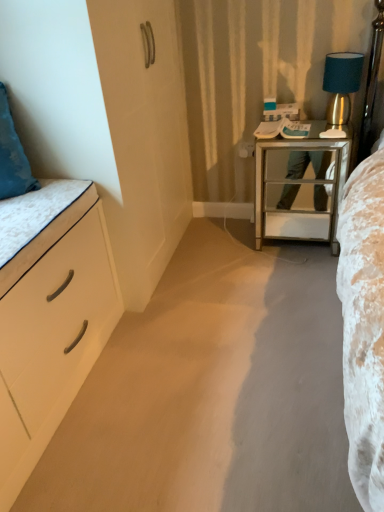
Question: Considering the relative sizes of mirrored glass nightstand at center right and teal fabric lampshade at upper right in the image provided, is mirrored glass nightstand at center right smaller than teal fabric lampshade at upper right?

Choices:
 (A) yes
 (B) no

Answer: (B)

Question: Does mirrored glass nightstand at center right have a larger size compared to teal fabric lampshade at upper right?

Choices:
 (A) no
 (B) yes

Answer: (B)

Question: Is mirrored glass nightstand at center right further to the viewer compared to teal fabric lampshade at upper right?

Choices:
 (A) yes
 (B) no

Answer: (B)

Question: Considering the relative sizes of mirrored glass nightstand at center right and teal fabric lampshade at upper right in the image provided, is mirrored glass nightstand at center right taller than teal fabric lampshade at upper right?

Choices:
 (A) no
 (B) yes

Answer: (B)

Question: Is mirrored glass nightstand at center right located outside teal fabric lampshade at upper right?

Choices:
 (A) no
 (B) yes

Answer: (B)

Question: From a real-world perspective, is white matte chest of drawers at left physically located above or below mirrored glass nightstand at center right?

Choices:
 (A) above
 (B) below

Answer: (B)

Question: Considering the positions of white matte chest of drawers at left and mirrored glass nightstand at center right in the image, is white matte chest of drawers at left wider or thinner than mirrored glass nightstand at center right?

Choices:
 (A) thin
 (B) wide

Answer: (B)

Question: Does point (44, 354) appear closer or farther from the camera than point (329, 182)?

Choices:
 (A) closer
 (B) farther

Answer: (A)

Question: Would you say white matte chest of drawers at left is inside or outside mirrored glass nightstand at center right?

Choices:
 (A) inside
 (B) outside

Answer: (B)

Question: From the image's perspective, is white matte drawer at left positioned above or below white matte chest of drawers at left?

Choices:
 (A) above
 (B) below

Answer: (A)

Question: Would you say white matte drawer at left is inside or outside white matte chest of drawers at left?

Choices:
 (A) outside
 (B) inside

Answer: (A)

Question: Considering the positions of white matte drawer at left and white matte chest of drawers at left in the image, is white matte drawer at left taller or shorter than white matte chest of drawers at left?

Choices:
 (A) tall
 (B) short

Answer: (B)

Question: Looking at the image, does white matte drawer at left seem bigger or smaller compared to white matte chest of drawers at left?

Choices:
 (A) big
 (B) small

Answer: (B)

Question: Is mirrored glass nightstand at center right in front of or behind teal fabric lampshade at upper right in the image?

Choices:
 (A) front
 (B) behind

Answer: (A)

Question: Considering the relative positions of mirrored glass nightstand at center right and teal fabric lampshade at upper right in the image provided, is mirrored glass nightstand at center right to the left or to the right of teal fabric lampshade at upper right?

Choices:
 (A) left
 (B) right

Answer: (A)